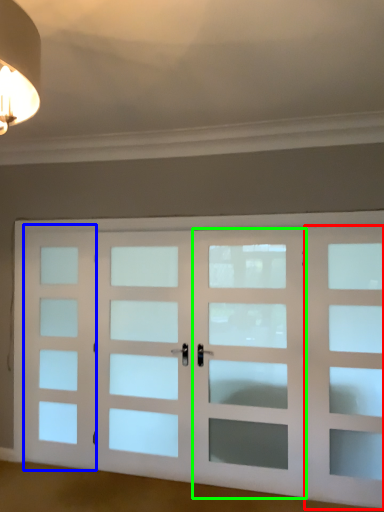
Question: Considering the real-world distances, which object is closest to screen door (highlighted by a red box)? screen door (highlighted by a blue box) or screen door (highlighted by a green box).

Choices:
 (A) screen door
 (B) screen door

Answer: (B)